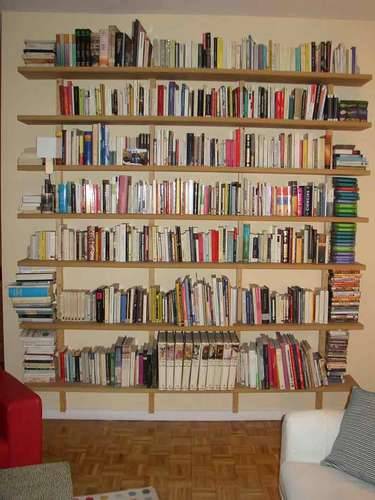
Image resolution: width=375 pixels, height=500 pixels. What are the coordinates of `shelf` in the screenshot? It's located at (202, 73), (198, 325), (179, 264).